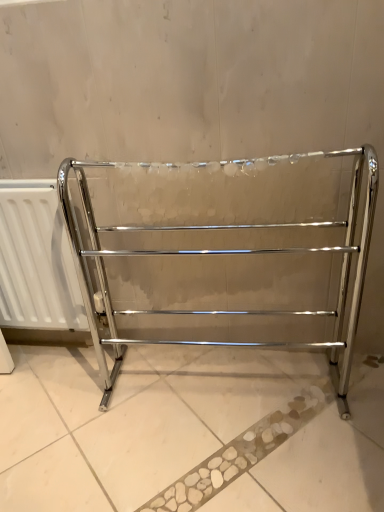
This screenshot has width=384, height=512. Describe the element at coordinates (221, 254) in the screenshot. I see `polished chrome towel rack at center` at that location.

Measure the distance between polished chrome towel rack at center and camera.

The distance of polished chrome towel rack at center from camera is 98.99 centimeters.

In order to click on polished chrome towel rack at center in this screenshot , I will do `click(221, 254)`.

In order to face polished chrome towel rack at center, should I rotate leftwards or rightwards?

A 3.616 degree turn to the right will do.

Describe the element at coordinates (36, 260) in the screenshot. The height and width of the screenshot is (512, 384). I see `white matte radiator at left` at that location.

Image resolution: width=384 pixels, height=512 pixels. Find the location of `white matte radiator at left`. white matte radiator at left is located at coordinates (36, 260).

Consider the image. What is the approximate width of white matte radiator at left?

white matte radiator at left is 3.78 inches wide.

Where is `polished chrome towel rack at center`? This screenshot has height=512, width=384. polished chrome towel rack at center is located at coordinates (221, 254).

Between polished chrome towel rack at center and white matte radiator at left, which one appears on the right side from the viewer's perspective?

polished chrome towel rack at center.

Considering the positions of objects polished chrome towel rack at center and white matte radiator at left in the image provided, who is in front, polished chrome towel rack at center or white matte radiator at left?

polished chrome towel rack at center.

Does point (347, 271) appear closer or farther from the camera than point (61, 273)?

Point (347, 271) appears to be closer to the viewer than point (61, 273).

From the image's perspective, is polished chrome towel rack at center over white matte radiator at left?

No.

From a real-world perspective, is polished chrome towel rack at center physically above white matte radiator at left?

Yes, from a real-world perspective, polished chrome towel rack at center is above white matte radiator at left.

Looking at their sizes, would you say polished chrome towel rack at center is wider or thinner than white matte radiator at left?

polished chrome towel rack at center is wider than white matte radiator at left.

Who is taller, polished chrome towel rack at center or white matte radiator at left?

Standing taller between the two is polished chrome towel rack at center.

Does polished chrome towel rack at center have a smaller size compared to white matte radiator at left?

Actually, polished chrome towel rack at center might be larger than white matte radiator at left.

Is polished chrome towel rack at center not within white matte radiator at left?

polished chrome towel rack at center is positioned outside white matte radiator at left.

Is polished chrome towel rack at center not close to white matte radiator at left?

They are positioned close to each other.

Is polished chrome towel rack at center positioned with its back to white matte radiator at left?

polished chrome towel rack at center is not turned away from white matte radiator at left.

The height and width of the screenshot is (512, 384). Identify the location of furniture in front of the white matte radiator at left. (221, 254).

In the scene shown: Is white matte radiator at left to the left or to the right of polished chrome towel rack at center in the image?

white matte radiator at left is to the left of polished chrome towel rack at center.

Which object is closer to the camera, white matte radiator at left or polished chrome towel rack at center?

polished chrome towel rack at center is more forward.

Is point (2, 203) positioned in front of point (256, 166)?

No, (2, 203) is behind (256, 166).

From the image's perspective, is white matte radiator at left above or below polished chrome towel rack at center?

white matte radiator at left is situated higher than polished chrome towel rack at center in the image.

From a real-world perspective, is white matte radiator at left physically above polished chrome towel rack at center?

No, from a real-world perspective, white matte radiator at left is not on top of polished chrome towel rack at center.

Can you confirm if white matte radiator at left is thinner than polished chrome towel rack at center?

Indeed, white matte radiator at left has a lesser width compared to polished chrome towel rack at center.

Between white matte radiator at left and polished chrome towel rack at center, which one has more height?

Standing taller between the two is polished chrome towel rack at center.

Does white matte radiator at left have a smaller size compared to polished chrome towel rack at center?

Indeed, white matte radiator at left has a smaller size compared to polished chrome towel rack at center.

Is polished chrome towel rack at center surrounded by white matte radiator at left?

Actually, polished chrome towel rack at center is outside white matte radiator at left.

Based on the photo, is white matte radiator at left positioned far away from polished chrome towel rack at center?

No, white matte radiator at left is not far away from polished chrome towel rack at center.

Is white matte radiator at left aimed at polished chrome towel rack at center?

No, white matte radiator at left is not oriented towards polished chrome towel rack at center.

What's the angular difference between white matte radiator at left and polished chrome towel rack at center's facing directions?

The angular difference between white matte radiator at left and polished chrome towel rack at center is 2.97 degrees.

How far apart are white matte radiator at left and polished chrome towel rack at center?

white matte radiator at left and polished chrome towel rack at center are 9.39 inches apart.

Identify the location of furniture on the right of white matte radiator at left. (221, 254).

Find the location of a particular element. furniture below the white matte radiator at left (from the image's perspective) is located at coordinates (221, 254).

Find the location of a particular element. This screenshot has height=512, width=384. radiator to the left of polished chrome towel rack at center is located at coordinates (36, 260).